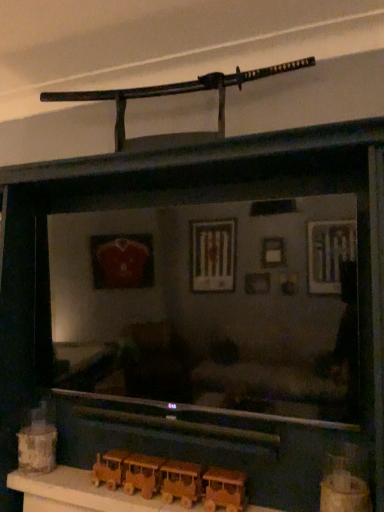
Question: Is wooden train at lower center, the first toy from the front, far away from wooden train at lower center, arranged as the second toy when viewed from the right?

Choices:
 (A) no
 (B) yes

Answer: (A)

Question: Is wooden train at lower center, which is the second toy in front-to-back order, completely or partially inside wooden train at lower center, the first toy when ordered from right to left?

Choices:
 (A) no
 (B) yes

Answer: (A)

Question: Is wooden train at lower center, the first toy from the front, located outside wooden train at lower center, arranged as the second toy when viewed from the right?

Choices:
 (A) no
 (B) yes

Answer: (B)

Question: Could you tell me if wooden train at lower center, which appears as the 3th toy when viewed from the left, is turned towards wooden train at lower center, which is the second toy in front-to-back order?

Choices:
 (A) no
 (B) yes

Answer: (A)

Question: Is wooden train at lower center, the third toy positioned from the back, thinner than wooden train at lower center, arranged as the second toy when viewed from the right?

Choices:
 (A) no
 (B) yes

Answer: (A)

Question: Is wooden train at lower center, the third toy positioned from the back, facing away from wooden train at lower center, the 2th toy from the left?

Choices:
 (A) no
 (B) yes

Answer: (A)

Question: Is wooden toy train at lower left, the first toy positioned from the back, in front of wooden train at lower center, the first toy when ordered from right to left?

Choices:
 (A) no
 (B) yes

Answer: (A)

Question: From a real-world perspective, is wooden toy train at lower left, which is counted as the 3th toy, starting from the front, on wooden train at lower center, the third toy positioned from the back?

Choices:
 (A) yes
 (B) no

Answer: (A)

Question: Is wooden toy train at lower left, which is counted as the 3th toy, starting from the front, behind wooden train at lower center, the first toy from the front?

Choices:
 (A) no
 (B) yes

Answer: (B)

Question: From the image's perspective, does wooden toy train at lower left, the first toy positioned from the back, appear lower than wooden train at lower center, which appears as the 3th toy when viewed from the left?

Choices:
 (A) yes
 (B) no

Answer: (A)

Question: Considering the relative sizes of wooden toy train at lower left, the first toy positioned from the back, and wooden train at lower center, the first toy when ordered from right to left, in the image provided, is wooden toy train at lower left, the first toy positioned from the back, smaller than wooden train at lower center, the first toy when ordered from right to left,?

Choices:
 (A) no
 (B) yes

Answer: (B)

Question: Is wooden toy train at lower left, which is counted as the 3th toy, starting from the front, positioned far away from wooden train at lower center, the first toy when ordered from right to left?

Choices:
 (A) no
 (B) yes

Answer: (B)

Question: Is wooden train at lower center, arranged as the second toy when viewed from the right, positioned beyond the bounds of wooden train set at lower center?

Choices:
 (A) yes
 (B) no

Answer: (A)